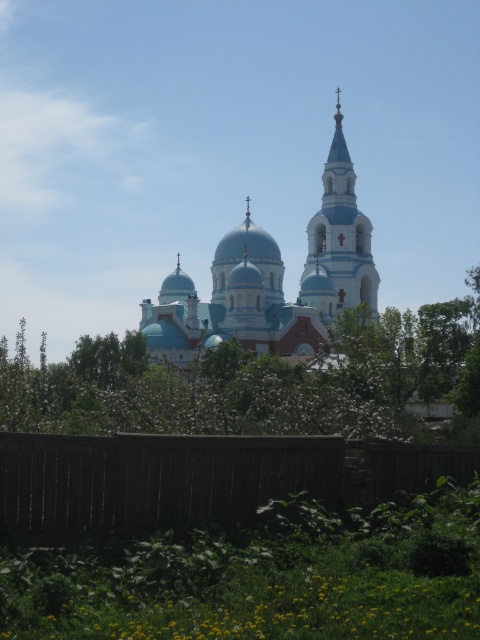
Question: Which object appears closest to the camera in this image?

Choices:
 (A) blue painted brick church at center
 (B) smooth blue tower at center

Answer: (A)

Question: Is green leafy tree at center thinner than brown wooden fence at lower center?

Choices:
 (A) yes
 (B) no

Answer: (B)

Question: Estimate the real-world distances between objects in this image. Which object is farther from the smooth blue tower at center?

Choices:
 (A) blue painted brick church at center
 (B) brown wooden fence at lower center
 (C) green leafy tree at center

Answer: (B)

Question: Is the position of blue painted brick church at center less distant than that of smooth blue tower at center?

Choices:
 (A) no
 (B) yes

Answer: (B)

Question: Which object is farther from the camera taking this photo?

Choices:
 (A) smooth blue tower at center
 (B) brown wooden fence at lower center

Answer: (A)

Question: Can you confirm if brown wooden fence at lower center is positioned above smooth blue tower at center?

Choices:
 (A) no
 (B) yes

Answer: (A)